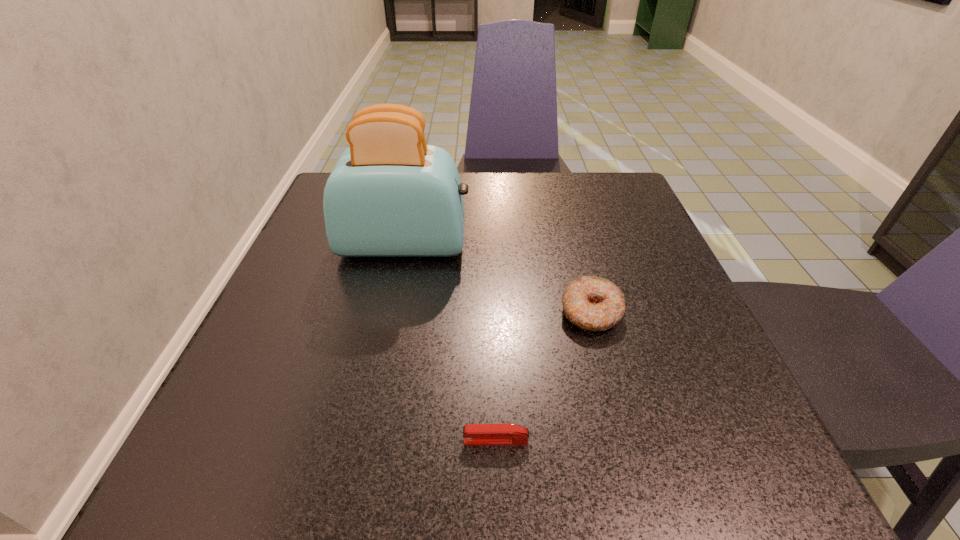
Where is `vacant space at the near left corner of the desktop`? vacant space at the near left corner of the desktop is located at coordinates (267, 482).

Identify the location of vacant area at the far right corner of the desktop. The height and width of the screenshot is (540, 960). (593, 207).

Locate an element on the screen. This screenshot has width=960, height=540. free spot between the second tallest object and the nearest object is located at coordinates (543, 376).

Where is `free spot between the rightmost object and the shortest object`? Image resolution: width=960 pixels, height=540 pixels. free spot between the rightmost object and the shortest object is located at coordinates (543, 376).

Locate an element on the screen. This screenshot has height=540, width=960. free area in between the leftmost object and the nearest object is located at coordinates (450, 342).

Identify which object is located as the second nearest to the toaster. Please provide its 2D coordinates. Your answer should be formatted as a tuple, i.e. [(x, y)], where the tuple contains the x and y coordinates of a point satisfying the conditions above.

[(474, 434)]

Identify the location of object that is the closest to the toaster. (591, 303).

Where is `vacant region that satisfies the following two spatial constraints: 1. on the side of the doughnut with the lever; 2. on the left side of the farthest object`? This screenshot has width=960, height=540. vacant region that satisfies the following two spatial constraints: 1. on the side of the doughnut with the lever; 2. on the left side of the farthest object is located at coordinates (390, 312).

Locate an element on the screen. The image size is (960, 540). vacant region that satisfies the following two spatial constraints: 1. on the side of the toaster with the lever; 2. on the left side of the second shortest object is located at coordinates (390, 312).

Locate an element on the screen. This screenshot has height=540, width=960. free region that satisfies the following two spatial constraints: 1. on the front side of the second farthest object; 2. on the front-facing side of the second object from left to right is located at coordinates (624, 441).